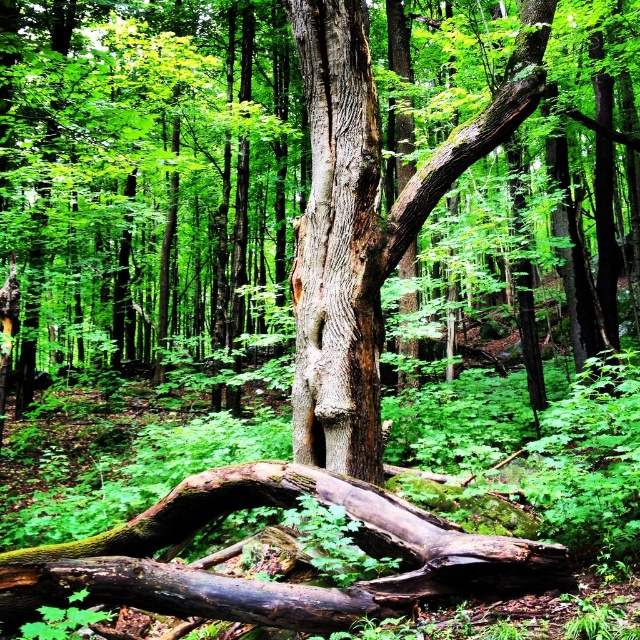
Is brown rough log at center positioned in front of smooth brown tree trunk at center?

Yes, it is in front of smooth brown tree trunk at center.

Which of these two, brown rough log at center or smooth brown tree trunk at center, stands shorter?

brown rough log at center is shorter.

This screenshot has height=640, width=640. What do you see at coordinates (276, 582) in the screenshot?
I see `brown rough log at center` at bounding box center [276, 582].

Where is `brown rough log at center`? The image size is (640, 640). brown rough log at center is located at coordinates (276, 582).